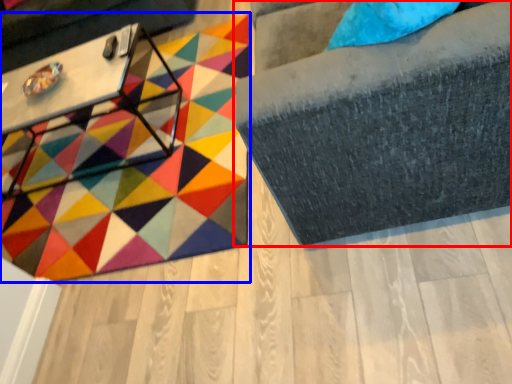
Question: Which of the following is the closest to the observer, furniture (highlighted by a red box) or mat (highlighted by a blue box)?

Choices:
 (A) furniture
 (B) mat

Answer: (A)